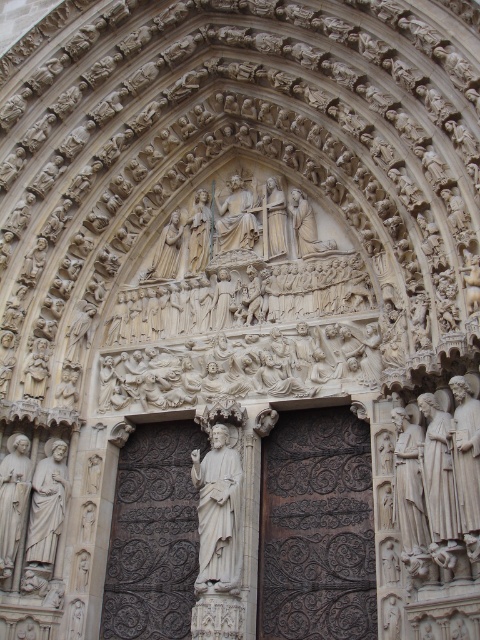
Is white marble statue at lower left positioned at the back of polished stone statue at center?

No, white marble statue at lower left is closer to the viewer.

Based on the photo, can you confirm if white marble statue at lower left is taller than polished stone statue at center?

Yes, white marble statue at lower left is taller than polished stone statue at center.

Describe the element at coordinates (47, 504) in the screenshot. I see `white marble statue at lower left` at that location.

At what (x,y) coordinates should I click in order to perform the action: click on white marble statue at lower left. Please return your answer as a coordinate pair (x, y). Image resolution: width=480 pixels, height=640 pixels. Looking at the image, I should click on (47, 504).

Who is lower down, dark brown wood at center or polished stone statue at center?

dark brown wood at center is below.

Does dark brown wood at center have a greater height compared to polished stone statue at center?

Correct, dark brown wood at center is much taller as polished stone statue at center.

The width and height of the screenshot is (480, 640). What do you see at coordinates (316, 528) in the screenshot? I see `dark brown wood at center` at bounding box center [316, 528].

Locate an element on the screen. The width and height of the screenshot is (480, 640). dark brown wood at center is located at coordinates (316, 528).

Is point (215, 422) positioned in front of point (49, 560)?

No, (215, 422) is behind (49, 560).

Measure the distance between point (199, 531) and camera.

Point (199, 531) is 46.04 meters from camera.

Describe the element at coordinates (218, 513) in the screenshot. I see `white marble statue at center` at that location.

Identify the location of white marble statue at center. (218, 513).